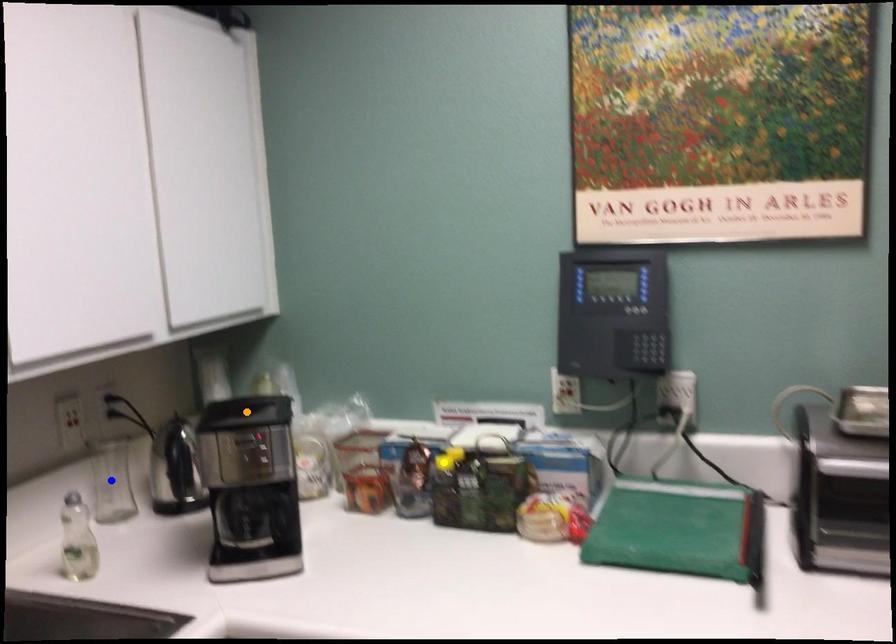
Order these from nearest to farthest:
1. orange point
2. yellow point
3. blue point

orange point < yellow point < blue point